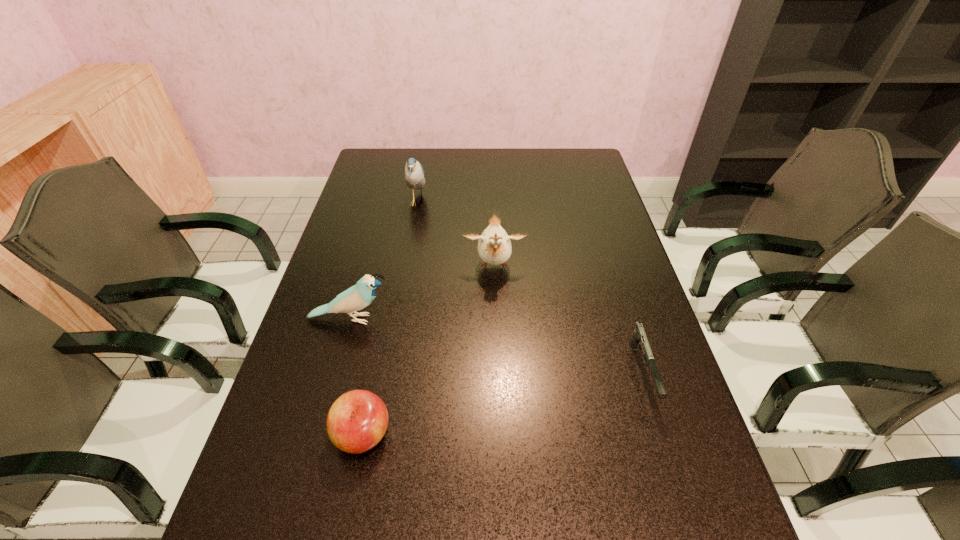
Find the location of a particular element. This screenshot has width=960, height=540. vacant position located on the left of the second shortest object is located at coordinates (304, 435).

Find the location of `free space located 0.130m at the muzzle end of the gun`. free space located 0.130m at the muzzle end of the gun is located at coordinates (674, 476).

At what (x,y) coordinates should I click in order to perform the action: click on bird located in the left edge section of the desktop. Please return your answer as a coordinate pair (x, y). Looking at the image, I should click on (357, 297).

Find the location of a particular element. The height and width of the screenshot is (540, 960). apple that is at the left edge is located at coordinates (357, 421).

The height and width of the screenshot is (540, 960). Identify the location of object positioned at the right edge. (639, 338).

I want to click on vacant space at the far edge, so click(x=497, y=162).

The image size is (960, 540). What are the coordinates of `free point at the left edge` in the screenshot? It's located at (385, 200).

In the image, there is a desktop. Where is `vacant space at the right edge`? The width and height of the screenshot is (960, 540). vacant space at the right edge is located at coordinates (662, 455).

Where is `blank space at the far left corner`? The image size is (960, 540). blank space at the far left corner is located at coordinates (396, 158).

Find the location of a particular element. free spot at the far right corner of the desktop is located at coordinates (581, 156).